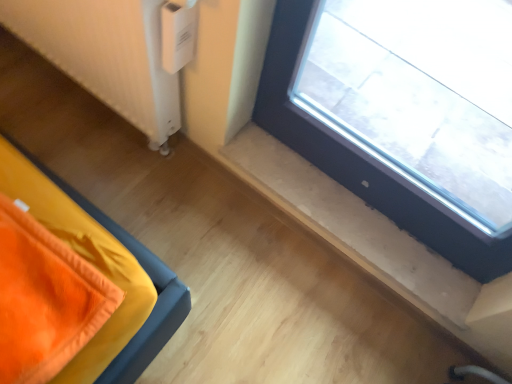
Locate an element on the screen. The width and height of the screenshot is (512, 384). vacant space in front of white plastic radiator at lower left is located at coordinates (80, 159).